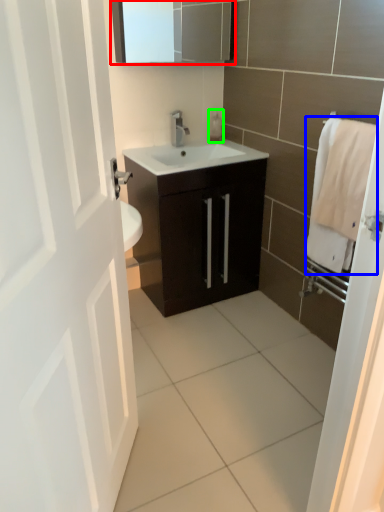
Question: Considering the real-world distances, which object is closest to medicine cabinet (highlighted by a red box)? bath towel (highlighted by a blue box) or soap dispenser (highlighted by a green box).

Choices:
 (A) bath towel
 (B) soap dispenser

Answer: (B)